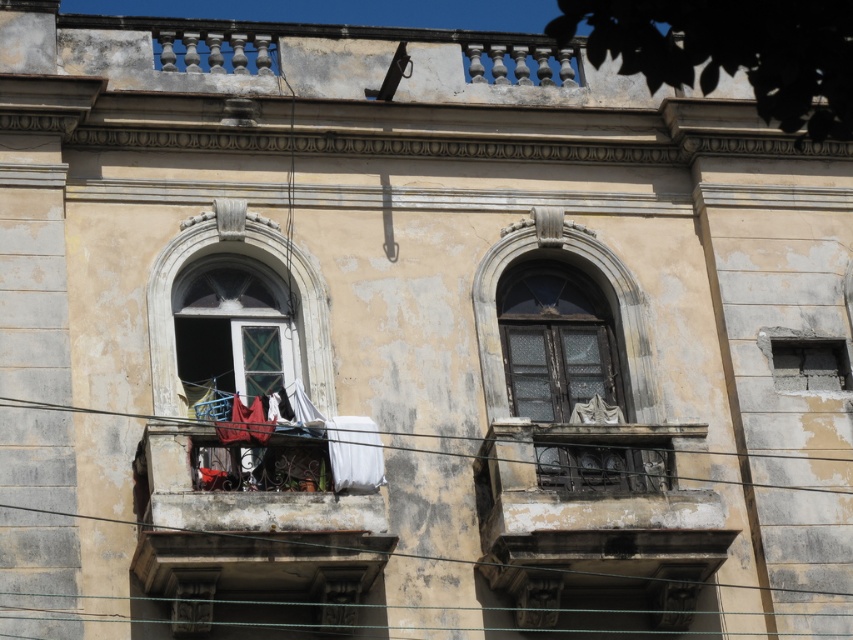
You are standing in front of an old building with two arched windows. You notice a point marked at coordinate [231,330]. Based on the scene description, what object is located at that point?

The point at coordinate [231,330] indicates the location of the matte glass window at center.